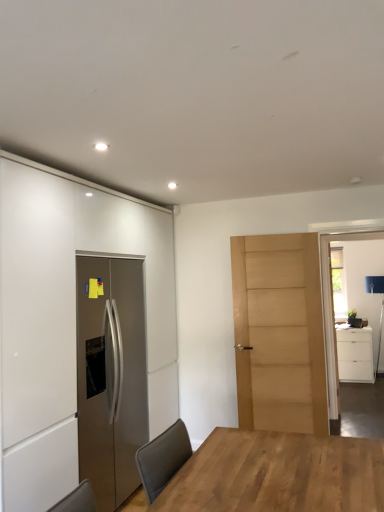
Question: Considering the relative sizes of light brown wooden table at center and clear glass door at right in the image provided, is light brown wooden table at center thinner than clear glass door at right?

Choices:
 (A) yes
 (B) no

Answer: (B)

Question: Can you confirm if light brown wooden table at center is smaller than clear glass door at right?

Choices:
 (A) no
 (B) yes

Answer: (B)

Question: Is light brown wooden table at center outside clear glass door at right?

Choices:
 (A) yes
 (B) no

Answer: (A)

Question: Is light brown wooden table at center at the right side of clear glass door at right?

Choices:
 (A) yes
 (B) no

Answer: (B)

Question: Does light brown wooden table at center have a greater width compared to clear glass door at right?

Choices:
 (A) no
 (B) yes

Answer: (B)

Question: Is white matte cabinet at left, which is the 1th cabinetry in front-to-back order, wider or thinner than clear glass door at right?

Choices:
 (A) thin
 (B) wide

Answer: (B)

Question: Based on their sizes in the image, would you say white matte cabinet at left, the 2th cabinetry in the right-to-left sequence, is bigger or smaller than clear glass door at right?

Choices:
 (A) big
 (B) small

Answer: (A)

Question: Does point (129, 230) appear closer or farther from the camera than point (337, 378)?

Choices:
 (A) farther
 (B) closer

Answer: (B)

Question: Is white matte cabinet at left, the 2th cabinetry in the right-to-left sequence, to the left or to the right of clear glass door at right in the image?

Choices:
 (A) right
 (B) left

Answer: (B)

Question: Is light brown wood door at center taller or shorter than white matte cabinet at right, acting as the 1th cabinetry starting from the right?

Choices:
 (A) tall
 (B) short

Answer: (A)

Question: In terms of width, does light brown wood door at center look wider or thinner when compared to white matte cabinet at right, the first cabinetry from the back?

Choices:
 (A) wide
 (B) thin

Answer: (B)

Question: Is light brown wood door at center bigger or smaller than white matte cabinet at right, acting as the 1th cabinetry starting from the right?

Choices:
 (A) small
 (B) big

Answer: (A)

Question: From a real-world perspective, relative to white matte cabinet at right, acting as the 2th cabinetry starting from the left, is light brown wood door at center vertically above or below?

Choices:
 (A) below
 (B) above

Answer: (B)

Question: Considering their positions, is light brown wood door at center located in front of or behind clear glass door at right?

Choices:
 (A) behind
 (B) front

Answer: (A)

Question: Considering the positions of light brown wood door at center and clear glass door at right in the image, is light brown wood door at center wider or thinner than clear glass door at right?

Choices:
 (A) wide
 (B) thin

Answer: (B)